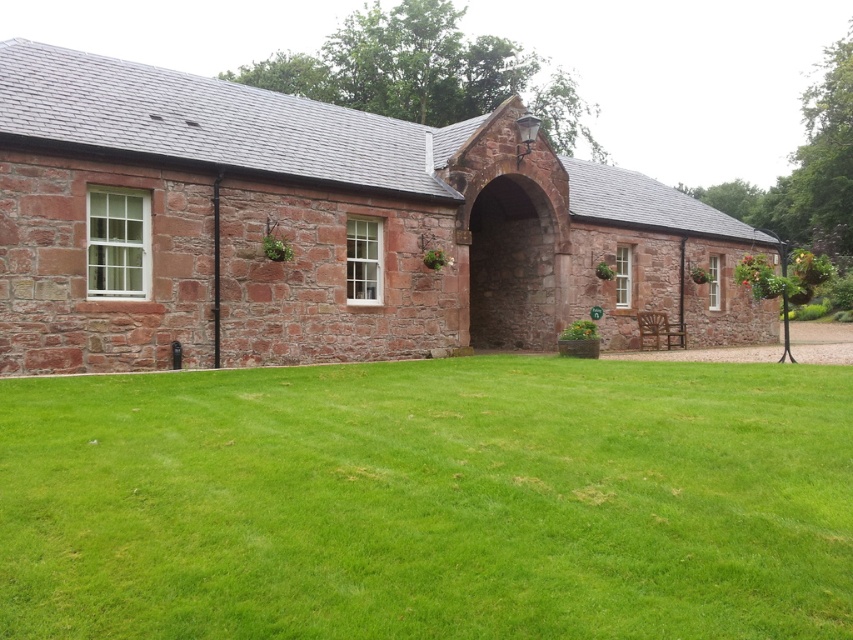
Is point (566, 316) less distant than point (514, 284)?

Yes, it is.

Which is more to the right, rustic stone chapel at center or rustic stone archway at center?

Positioned to the right is rustic stone chapel at center.

You are a GUI agent. You are given a task and a screenshot of the screen. Output one action in this format:
    pyautogui.click(x=<x>, y=<y>)
    Task: Click on the rustic stone chapel at center
    This screenshot has width=853, height=640.
    Given the screenshot: What is the action you would take?
    pyautogui.click(x=320, y=228)

Is green grass at center below rustic stone archway at center?

Yes, green grass at center is below rustic stone archway at center.

Between green grass at center and rustic stone archway at center, which one is positioned lower?

Positioned lower is green grass at center.

Is point (256, 576) closer to camera compared to point (527, 278)?

Yes, point (256, 576) is in front of point (527, 278).

What are the coordinates of `green grass at center` in the screenshot? It's located at (428, 500).

Does green grass at center have a greater width compared to rustic stone chapel at center?

No.

Between green grass at center and rustic stone chapel at center, which one has more height?

rustic stone chapel at center

The image size is (853, 640). I want to click on green grass at center, so click(x=428, y=500).

Find the location of a particular element. This screenshot has height=640, width=853. green grass at center is located at coordinates (428, 500).